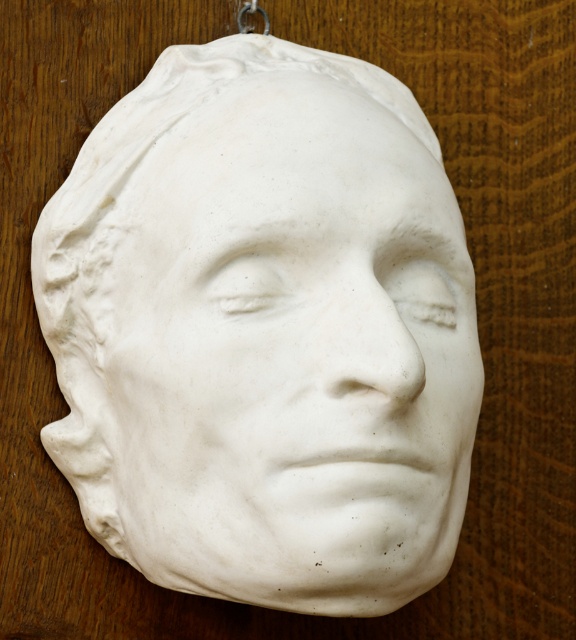
You are an art conservator examining the white marble mask at center and the metallic ring at upper center. Which object is positioned closer to your viewpoint?

The white marble mask at center is closer to the viewer than the metallic ring at upper center.

You are an art conservator examining the image. You need to determine if the white marble mask at center can be safely placed on a shelf that can only hold items smaller than the metallic ring at upper center. Based on their sizes, what is your conclusion?

The white marble mask at center is bigger than the metallic ring at upper center, so it cannot be safely placed on the shelf since it exceeds the size limit.

You are an art conservator examining the plaster cast of a human face. You notice two points on the cast labeled as point 1 at coordinates point (108, 506) and point 2 at coordinates point (264, 13). Which point is positioned closer to your viewpoint?

Point (108, 506) is closer to the viewer than point (264, 13).